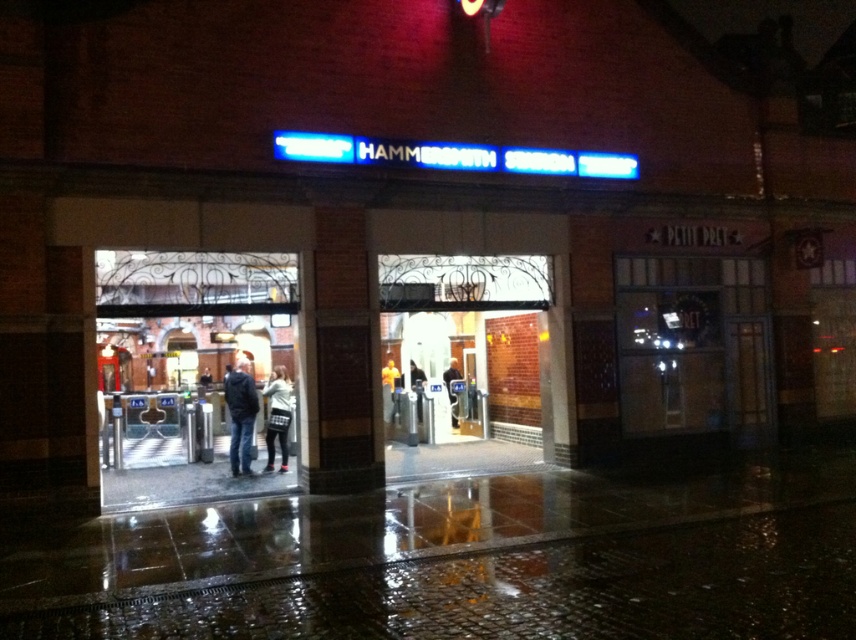
Identify the location of dark blue jacket at center. This screenshot has width=856, height=640. (241, 413).

Who is shorter, dark blue jacket at center or white sweater at center?

dark blue jacket at center is shorter.

Does point (247, 422) come behind point (268, 435)?

No, (247, 422) is in front of (268, 435).

What are the coordinates of `dark blue jacket at center` in the screenshot? It's located at (241, 413).

Find the location of a particular element. dark blue jacket at center is located at coordinates (241, 413).

Does point (239, 376) come farther from viewer compared to point (455, 401)?

That is False.

Who is more distant from viewer, (232, 428) or (449, 388)?

Positioned behind is point (449, 388).

Where is `dark blue jacket at center`? dark blue jacket at center is located at coordinates (241, 413).

Does brown brick pillar at center have a larger size compared to white sweater at center?

Yes, brown brick pillar at center is bigger than white sweater at center.

Is point (311, 312) closer to viewer compared to point (284, 413)?

Yes, it is.

What are the coordinates of `brown brick pillar at center` in the screenshot? It's located at (340, 356).